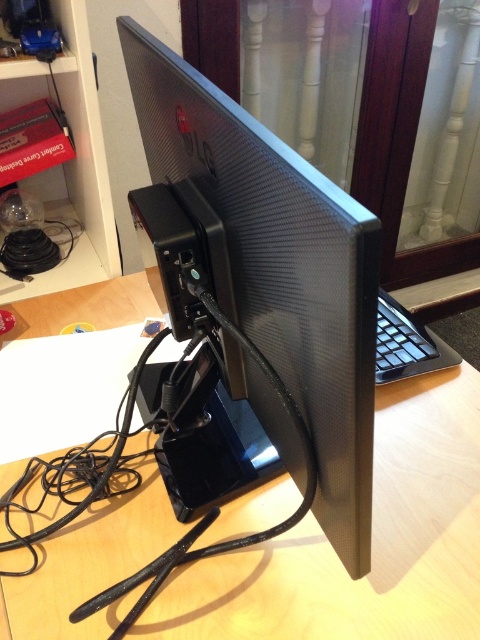
You are standing in front of the wooden computer desk at center and want to take a photo of it with your phone. Considering the distance between you and the desk, will you need to step back to capture the entire desk in one shot?

The wooden computer desk at center is 20.73 inches from camera. Since most phones have a wide enough angle to capture objects at that distance without needing to step back, you can likely capture the entire desk without moving further back.

You are trying to set up a new monitor on the wooden computer desk at center. Based on the image description, can you determine the exact coordinates where the desk is positioned?

The wooden computer desk at center is located at point (372, 545) according to the image description.